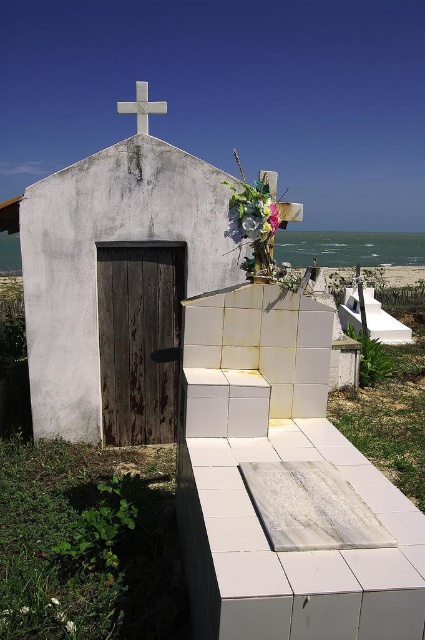
You are standing at the beach near the chapel and want to walk towards the grave marker. You notice two points marked on the ground. One is at point (110, 280) and the other at point (144, 92). Which point is closer to you as you face the chapel?

Point (110, 280) is closer to you because it is further to the viewer than point (144, 92).

You are standing in front of the chapel and see the white matte flower at upper center and the white marble cross at upper center. Which object is closer to the ground?

The white matte flower at upper center is positioned under the white marble cross at upper center, so it is closer to the ground.